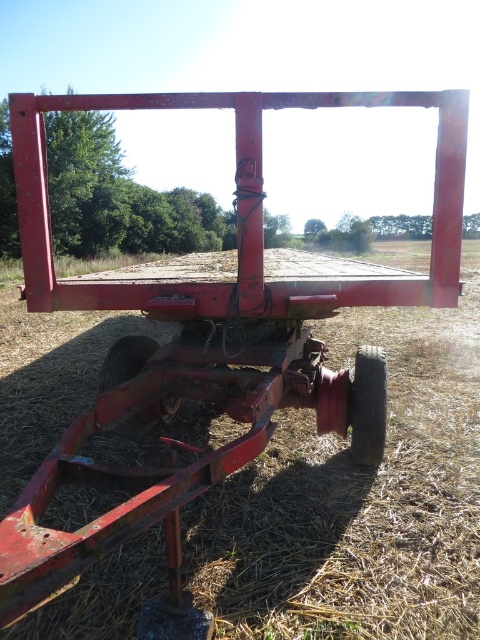
You are standing at the back of the red agricultural trailer and want to walk towards the front. Which point, point (377, 387) or point (160, 408), will you encounter first?

Point (377, 387) is in front of point (160, 408), so you will encounter point (377, 387) first as you walk towards the front of the trailer.